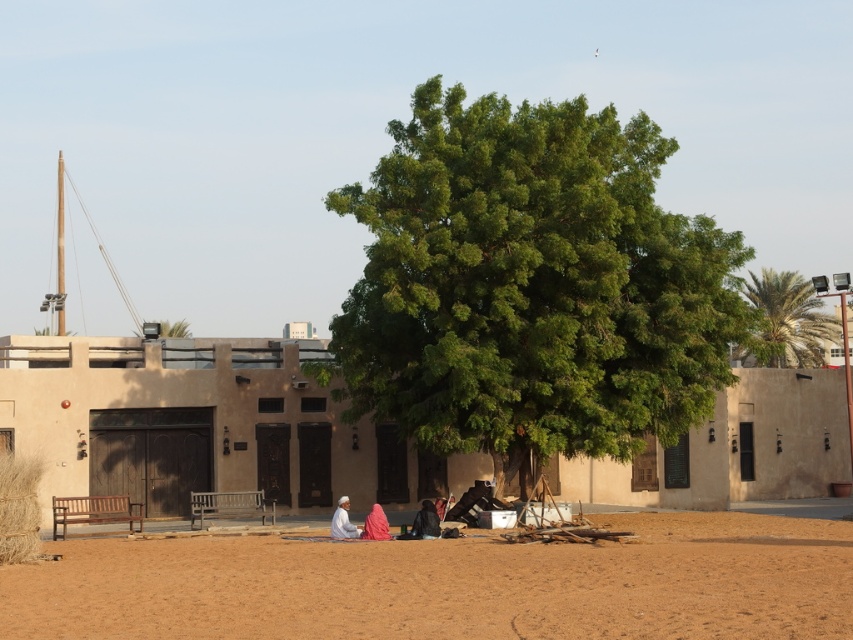
Which is in front, point (323, 564) or point (376, 529)?

Positioned in front is point (323, 564).

Describe the element at coordinates (450, 584) in the screenshot. I see `brown sandy dirt field at lower center` at that location.

I want to click on brown sandy dirt field at lower center, so click(450, 584).

Where is `brown sandy dirt field at lower center`? Image resolution: width=853 pixels, height=640 pixels. brown sandy dirt field at lower center is located at coordinates (450, 584).

Who is higher up, green leafy tree at center or brown sandy dirt field at lower center?

green leafy tree at center is above.

Locate an element on the screen. Image resolution: width=853 pixels, height=640 pixels. green leafy tree at center is located at coordinates (531, 285).

Does green leafy tree at center have a greater height compared to pink fabric at center?

Yes, green leafy tree at center is taller than pink fabric at center.

Between point (566, 429) and point (381, 509), which one is positioned behind?

Positioned behind is point (566, 429).

At what (x,y) coordinates should I click in order to perform the action: click on green leafy tree at center. Please return your answer as a coordinate pair (x, y). The width and height of the screenshot is (853, 640). Looking at the image, I should click on (531, 285).